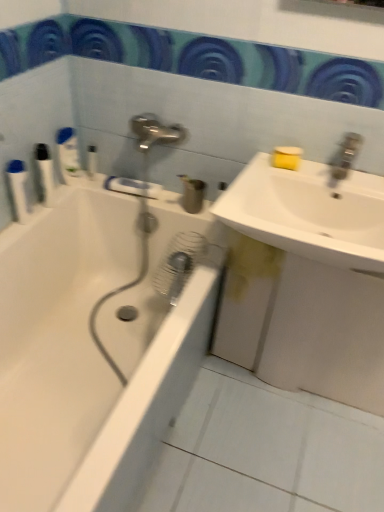
The image size is (384, 512). Find the location of `free space between white plastic towel bar at upper center and matte plastic cup at center, the 5th toiletry when ordered from left to right`. free space between white plastic towel bar at upper center and matte plastic cup at center, the 5th toiletry when ordered from left to right is located at coordinates (161, 202).